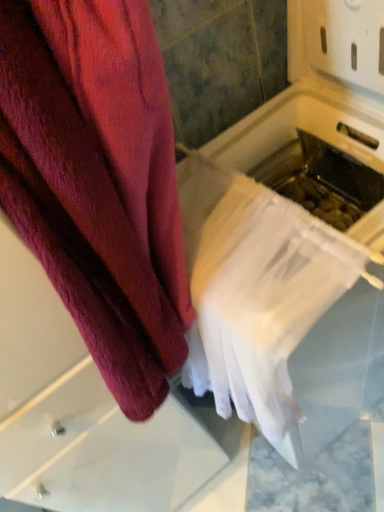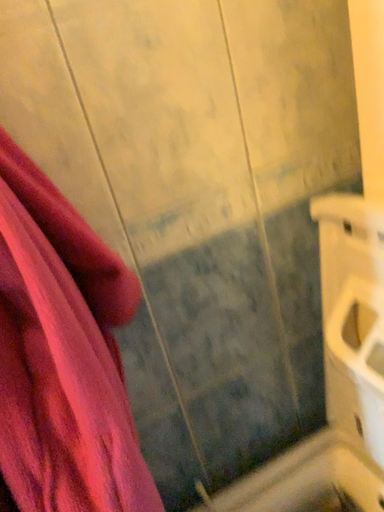
Question: Which way did the camera rotate in the video?

Choices:
 (A) rotated right
 (B) rotated left

Answer: (B)